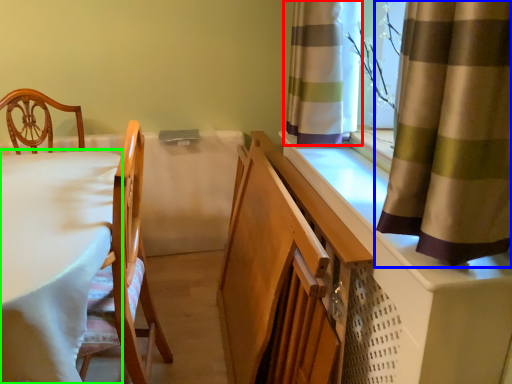
Question: Which is farther away from curtain (highlighted by a red box)? curtain (highlighted by a blue box) or table (highlighted by a green box)?

Choices:
 (A) curtain
 (B) table

Answer: (B)